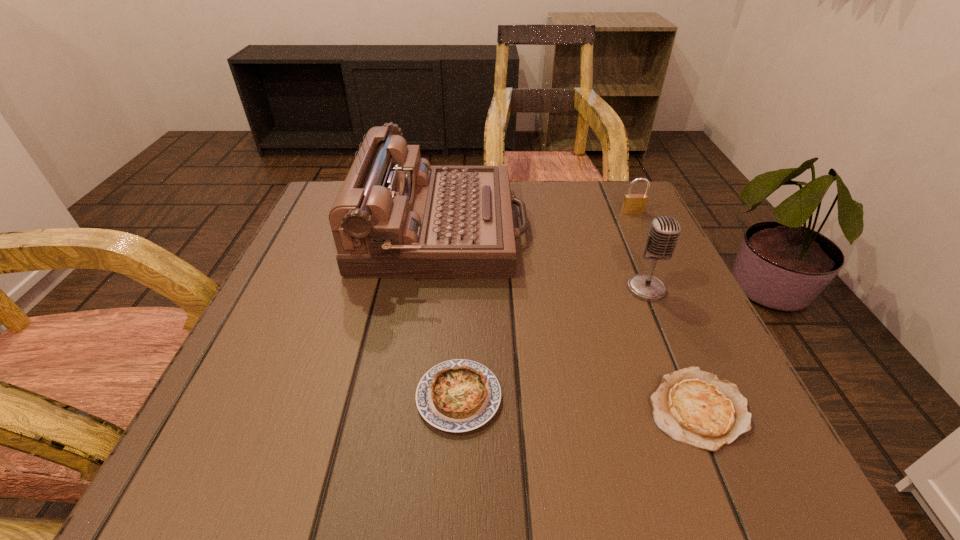
The width and height of the screenshot is (960, 540). Identify the location of empty location between the left quiche and the tallest object. (450, 313).

Where is `unoccupied area between the shortest object and the left quiche`? The width and height of the screenshot is (960, 540). unoccupied area between the shortest object and the left quiche is located at coordinates (579, 403).

Locate an element on the screen. free space between the fourth shortest object and the right quiche is located at coordinates (672, 348).

This screenshot has width=960, height=540. What are the coordinates of `free space between the right quiche and the microphone` in the screenshot? It's located at (672, 348).

In order to click on free spot between the taller quiche and the padlock in this screenshot , I will do `click(545, 305)`.

Locate an element on the screen. This screenshot has height=540, width=960. free space between the third shortest object and the right quiche is located at coordinates (665, 310).

Where is `free area in between the left quiche and the padlock`? This screenshot has width=960, height=540. free area in between the left quiche and the padlock is located at coordinates (545, 305).

Locate an element on the screen. Image resolution: width=960 pixels, height=540 pixels. free space between the padlock and the typewriter is located at coordinates (538, 220).

Locate an element on the screen. Image resolution: width=960 pixels, height=540 pixels. object that ranks as the fourth closest to the left quiche is located at coordinates (633, 203).

In order to click on object that stands as the second closest to the left quiche in this screenshot , I will do `click(692, 406)`.